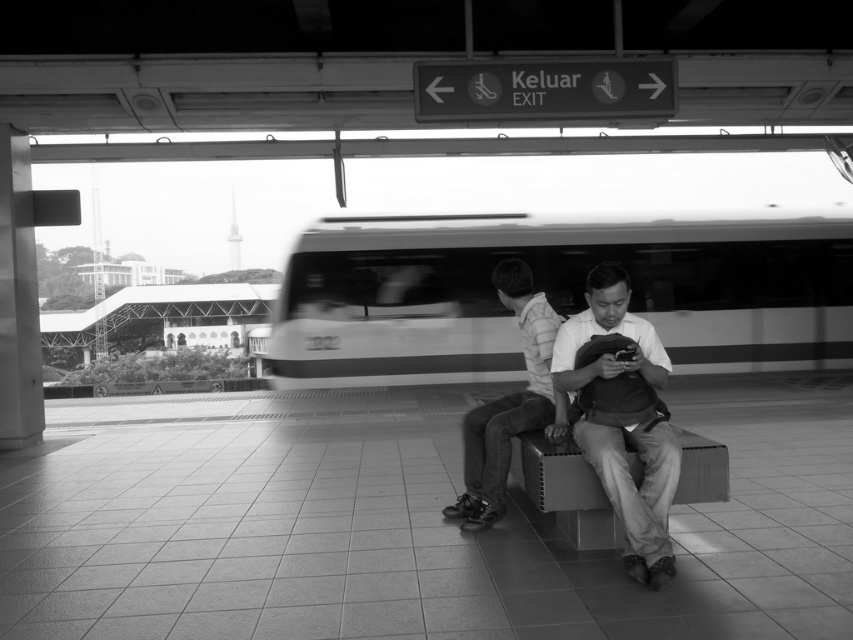
You are a photographer trying to capture a candid shot of the striped cotton shirt at center and the metallic gray bench at center. To ensure both are in frame, you need to know their relative positions. Which object is located to the left of the other?

The striped cotton shirt at center is positioned on the left side of metallic gray bench at center, so the striped cotton shirt at center is to the left of the metallic gray bench at center.

You are standing on the platform and see the smooth fabric shirt at center and the metallic gray bench at center. Which object is nearer to you?

The smooth fabric shirt at center is closer to the viewer than the metallic gray bench at center.